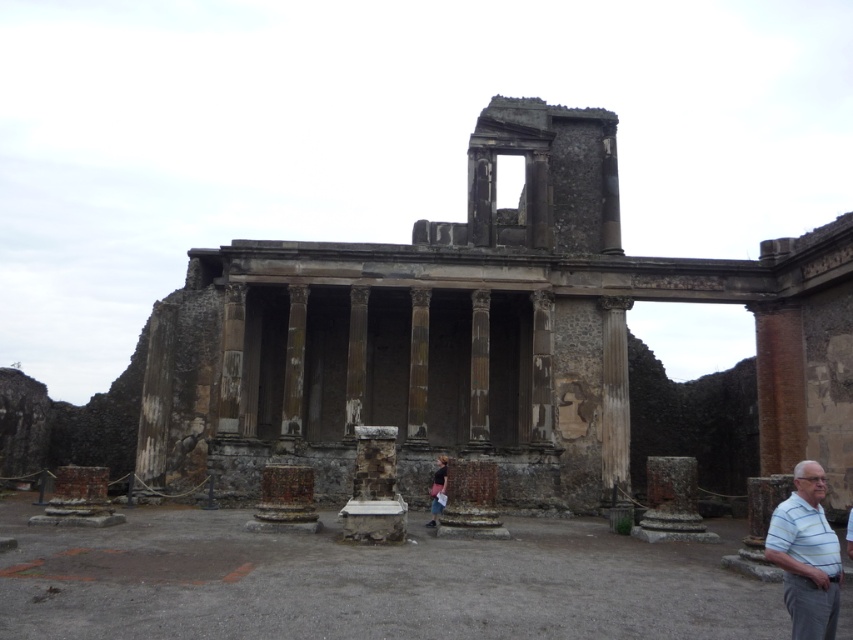
You are an archaeologist examining the ancient Roman structure. You see the rusty stone columns at center and the denim jacket at center. Which object is bigger?

The rusty stone columns at center are larger in size than the denim jacket at center.